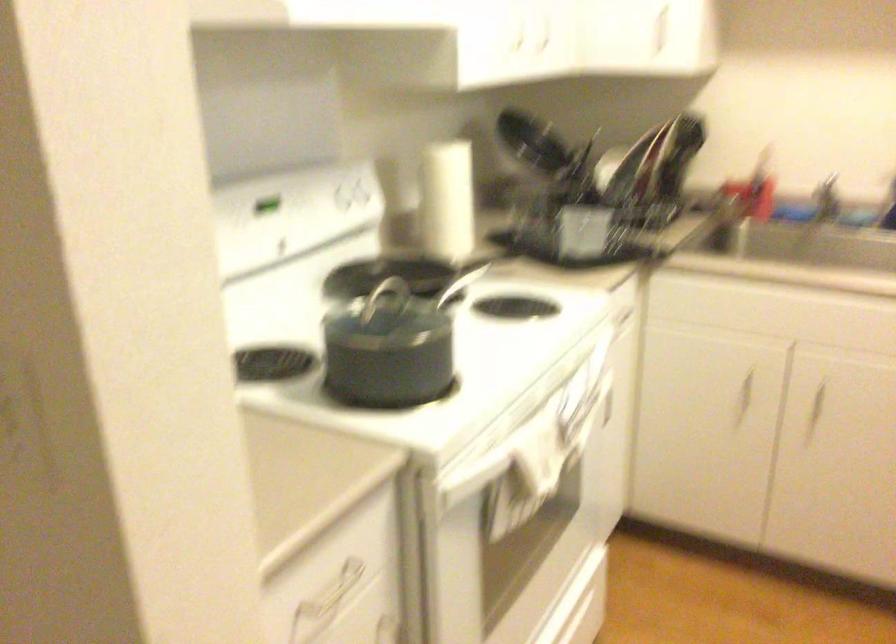
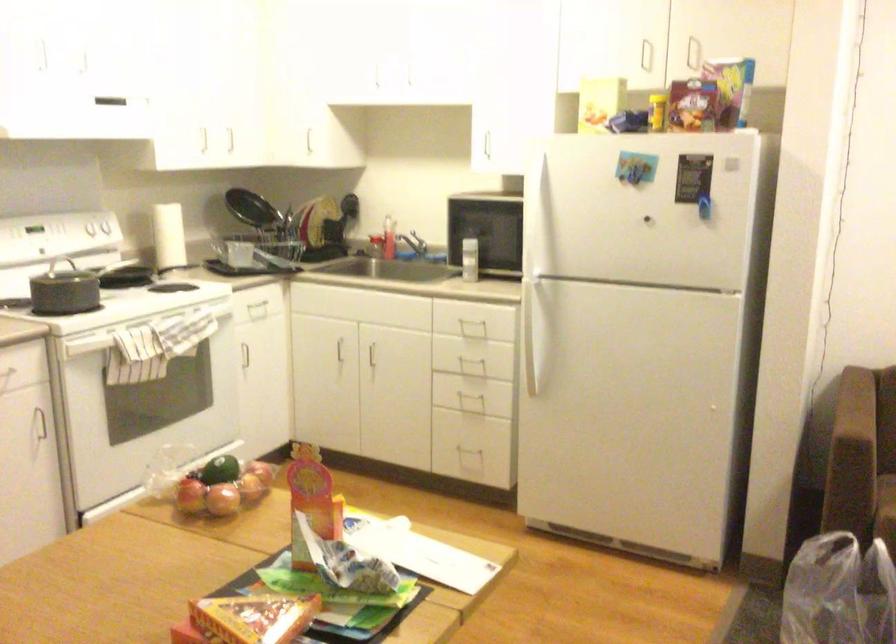
Question: I am providing you with two images of the same scene from different viewpoints. After the viewpoint changes to image2, which objects are now occluded?

Choices:
 (A) cereal box
 (B) sofa sitting surface
 (C) sink faucet handle
 (D) none of these

Answer: (D)